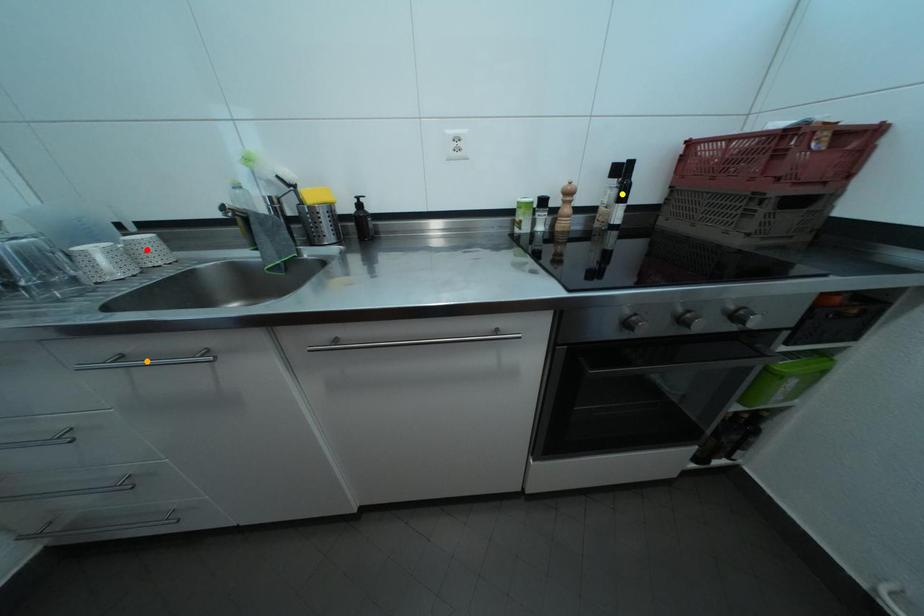
Order these from nearest to farthest:
yellow point, red point, orange point

orange point
red point
yellow point